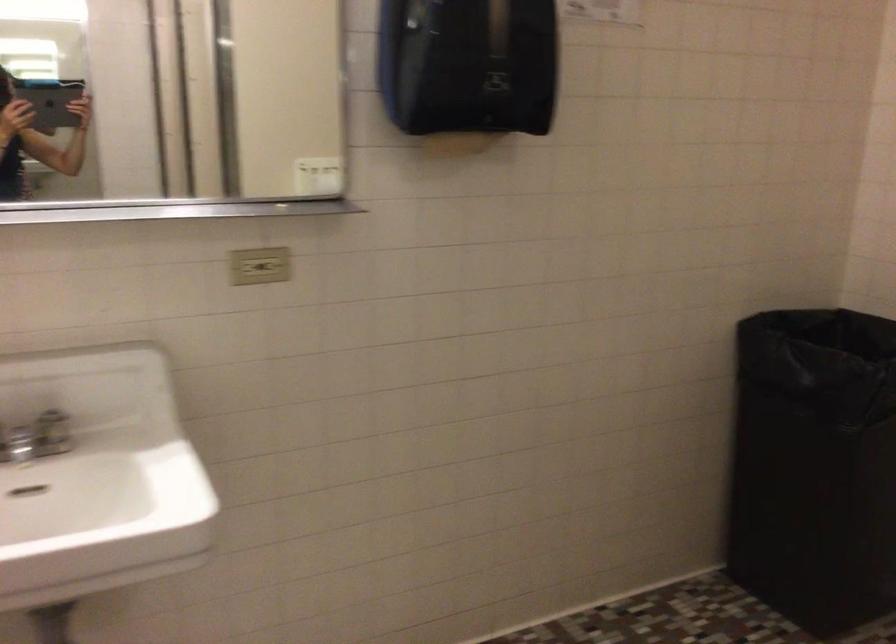
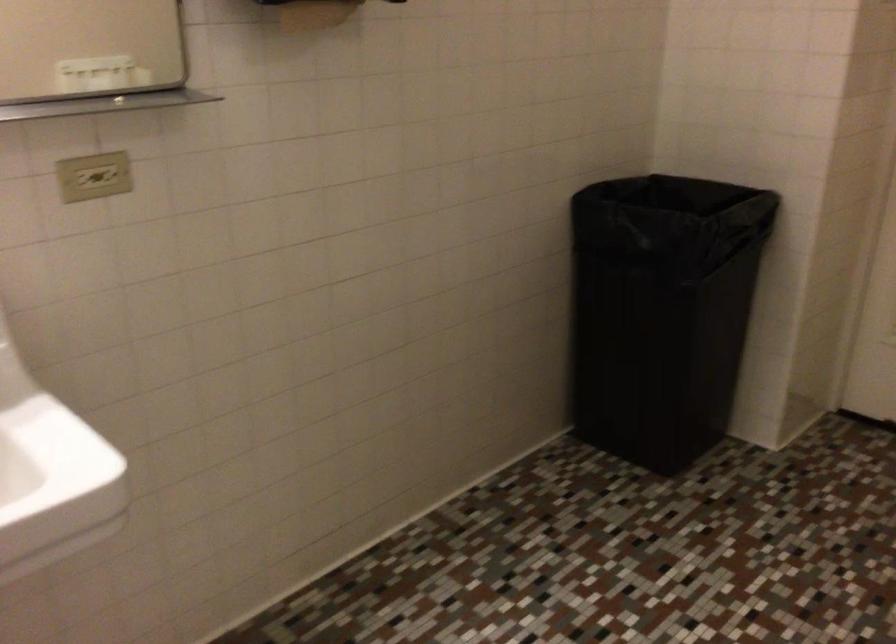
Question: The first image is from the beginning of the video and the second image is from the end. How did the camera likely rotate when shooting the video?

Choices:
 (A) Left
 (B) Right
 (C) Up
 (D) Down

Answer: (B)